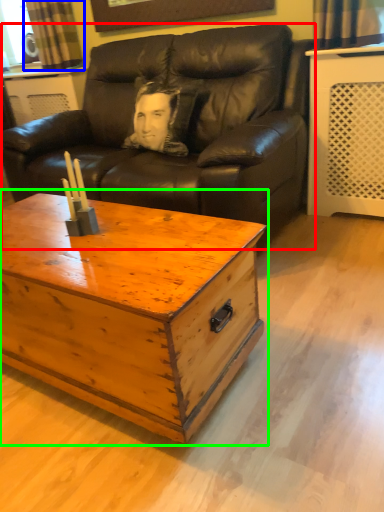
Question: Which object is positioned closest to studio couch (highlighted by a red box)? Select from curtain (highlighted by a blue box) and coffee table (highlighted by a green box).

Choices:
 (A) curtain
 (B) coffee table

Answer: (B)